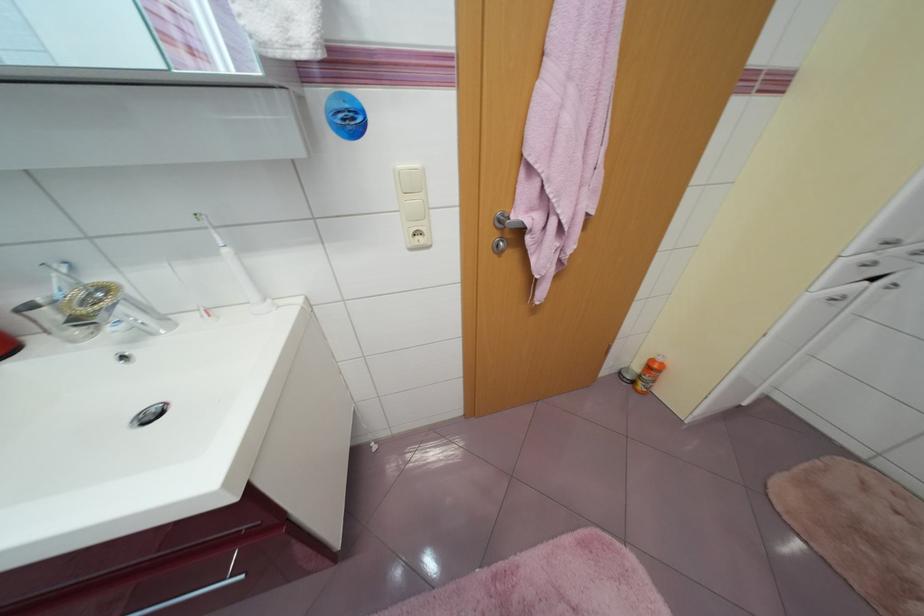
The height and width of the screenshot is (616, 924). Describe the element at coordinates (91, 302) in the screenshot. I see `the silver faucet handle` at that location.